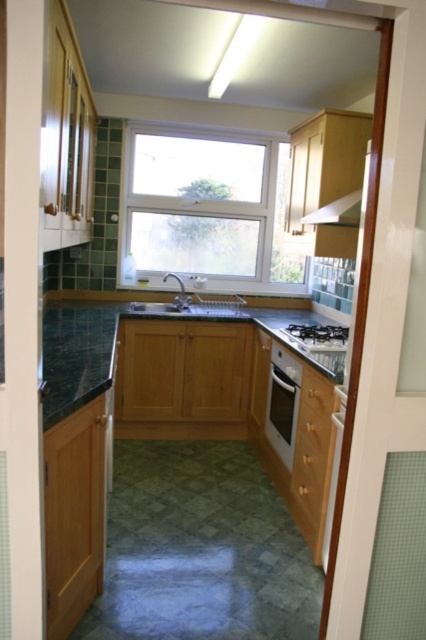
Question: Is clear glass window at center to the right of black matte gas stove at center from the viewer's perspective?

Choices:
 (A) no
 (B) yes

Answer: (A)

Question: Considering the relative positions of matte wood exhaust hood at upper right and white glossy exhaust hood at upper right in the image provided, where is matte wood exhaust hood at upper right located with respect to white glossy exhaust hood at upper right?

Choices:
 (A) above
 (B) below

Answer: (A)

Question: Which point is farther to the camera?

Choices:
 (A) green marble countertop at center
 (B) satin silver sink at center
 (C) white glossy exhaust hood at upper right

Answer: (B)

Question: Which point appears farthest from the camera in this image?

Choices:
 (A) (233, 216)
 (B) (218, 300)
 (C) (98, 324)
 (D) (336, 209)

Answer: (A)

Question: Does clear glass window at center appear on the left side of matte wood exhaust hood at upper right?

Choices:
 (A) yes
 (B) no

Answer: (A)

Question: Which point is farther to the camera?

Choices:
 (A) green marble countertop at center
 (B) white glossy exhaust hood at upper right
 (C) black matte gas stove at center
 (D) matte wood exhaust hood at upper right

Answer: (C)